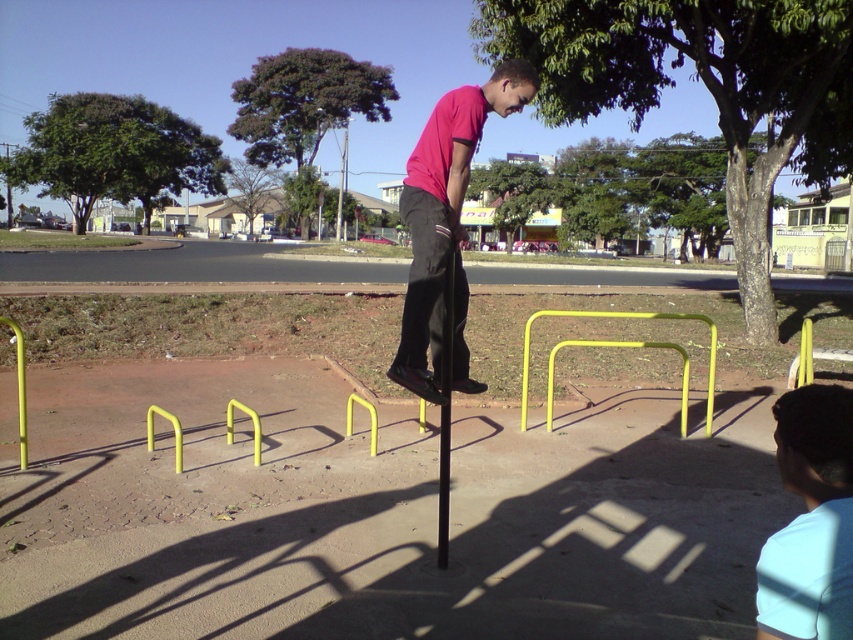
Is light blue fabric at lower right shorter than yellow matte hurdle at center?

Yes, light blue fabric at lower right is shorter than yellow matte hurdle at center.

Does point (811, 609) come behind point (604, 310)?

That is False.

I want to click on light blue fabric at lower right, so click(x=811, y=518).

Between point (419, 269) and point (712, 333), which one is positioned behind?

The point (712, 333) is more distant.

Based on the photo, who is shorter, matte pink shirt at center or yellow matte hurdle at center?

Standing shorter between the two is yellow matte hurdle at center.

Where is `matte pink shirt at center`? matte pink shirt at center is located at coordinates (444, 211).

Who is positioned more to the left, light blue fabric at lower right or matte pink shirt at center?

Positioned to the left is matte pink shirt at center.

Does light blue fabric at lower right appear on the right side of matte pink shirt at center?

Yes, light blue fabric at lower right is to the right of matte pink shirt at center.

Find the location of a particular element. light blue fabric at lower right is located at coordinates (811, 518).

What are the coordinates of `light blue fabric at lower right` in the screenshot? It's located at (811, 518).